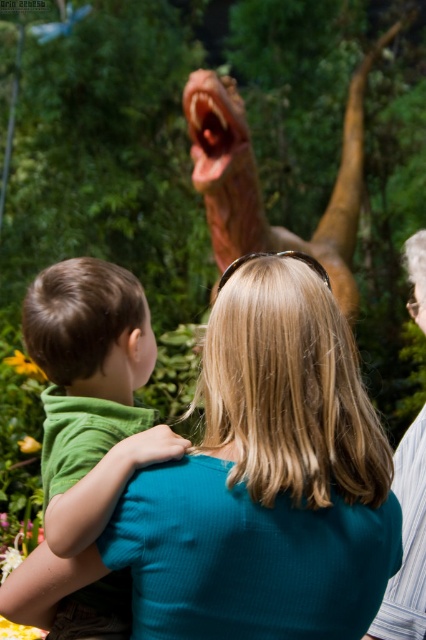
Question: Observing the image, what is the correct spatial positioning of teal ribbed shirt at center in reference to brown textured dinosaur at upper center?

Choices:
 (A) left
 (B) right

Answer: (A)

Question: Does teal ribbed shirt at center appear on the left side of striped fabric shirt at right?

Choices:
 (A) no
 (B) yes

Answer: (B)

Question: Which object is closer to the camera taking this photo?

Choices:
 (A) striped fabric shirt at right
 (B) brown textured dinosaur at upper center

Answer: (A)

Question: Considering the real-world distances, which object is closest to the striped fabric shirt at right?

Choices:
 (A) green matte shirt at upper left
 (B) brown textured dinosaur at upper center

Answer: (A)

Question: Which of the following is the closest to the observer?

Choices:
 (A) striped fabric shirt at right
 (B) teal ribbed shirt at center
 (C) brown textured dinosaur at upper center

Answer: (B)

Question: Is teal ribbed shirt at center positioned behind brown textured dinosaur at upper center?

Choices:
 (A) no
 (B) yes

Answer: (A)